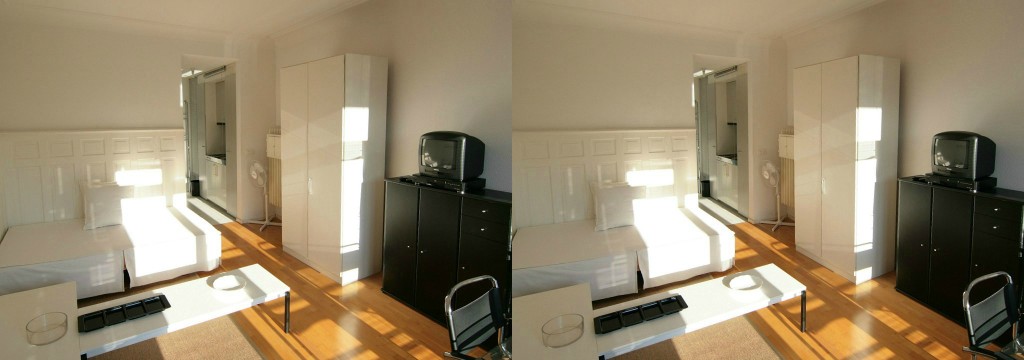
I want to click on chair, so click(478, 320), click(985, 310).